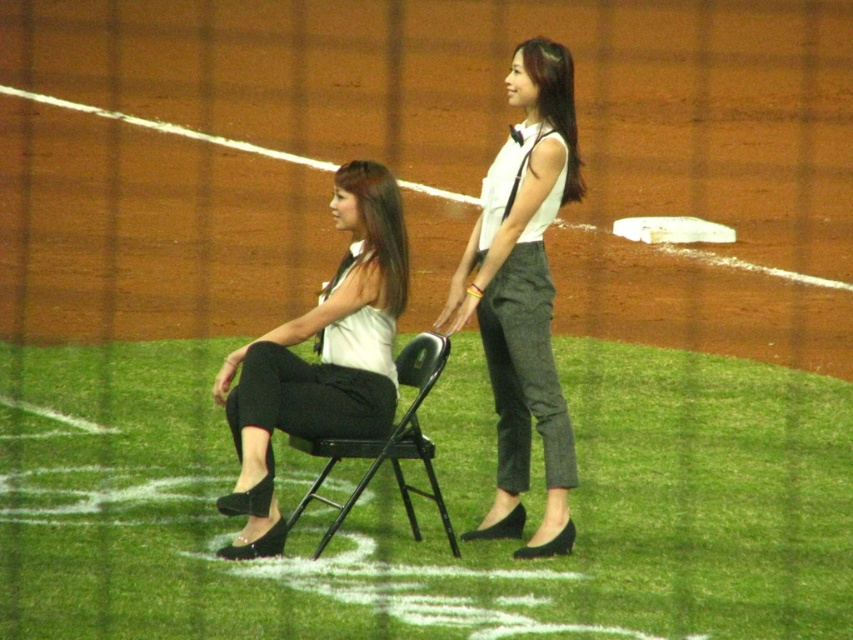
Between point (250, 419) and point (405, 349), which one is positioned in front?

Point (250, 419) is more forward.

Does point (250, 486) come in front of point (426, 344)?

Yes, it is in front of point (426, 344).

Find the location of a particular element. The image size is (853, 640). matte black pants at center is located at coordinates (321, 356).

Does white textured pants at center appear on the left side of black metal chair at center?

In fact, white textured pants at center is to the right of black metal chair at center.

From the picture: Who is more distant from viewer, (532, 56) or (432, 365)?

Positioned behind is point (532, 56).

What are the coordinates of `white textured pants at center` in the screenshot? It's located at (523, 294).

Image resolution: width=853 pixels, height=640 pixels. What do you see at coordinates (523, 294) in the screenshot?
I see `white textured pants at center` at bounding box center [523, 294].

Which is below, white textured pants at center or matte black pants at center?

matte black pants at center is below.

Where is `white textured pants at center`? white textured pants at center is located at coordinates pos(523,294).